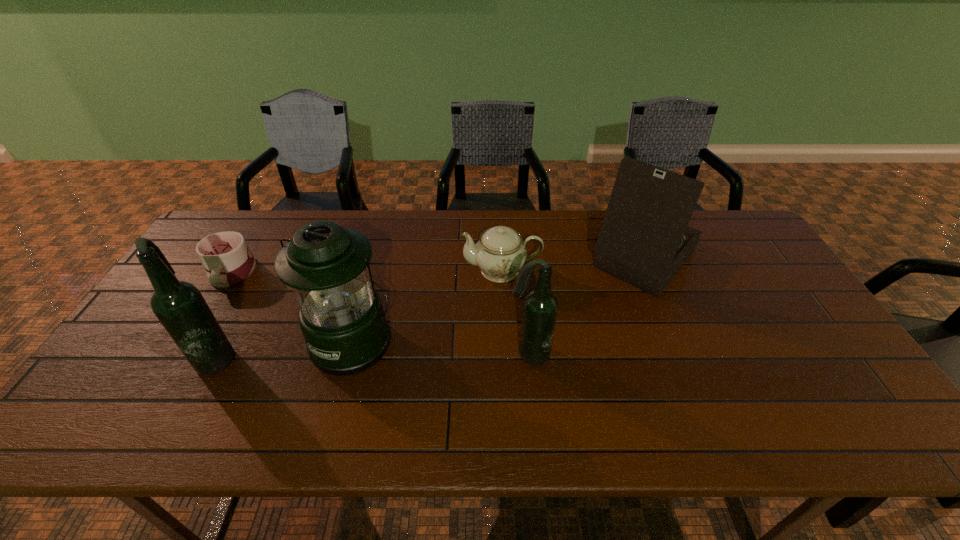
Locate an element on the screen. Image resolution: width=960 pixels, height=540 pixels. the left beer bottle is located at coordinates (180, 307).

This screenshot has height=540, width=960. Identify the location of the shorter beer bottle. (540, 308).

What are the coordinates of `the third shortest object` in the screenshot? It's located at (540, 308).

This screenshot has width=960, height=540. I want to click on the rightmost object, so click(x=644, y=240).

The height and width of the screenshot is (540, 960). What are the coordinates of `the fifth tallest object` in the screenshot? It's located at (500, 253).

Locate an element on the screen. The width and height of the screenshot is (960, 540). lantern is located at coordinates (341, 316).

You are a GUI agent. You are given a task and a screenshot of the screen. Output one action in this format:
    pyautogui.click(x=<x>, y=<y>)
    Task: Click on the shortest object
    The height and width of the screenshot is (540, 960).
    Given the screenshot: What is the action you would take?
    pyautogui.click(x=227, y=260)

The image size is (960, 540). I want to click on vacant space positioned 0.160m on the right of the left beer bottle, so click(x=300, y=356).

Locate an element on the screen. This screenshot has height=540, width=960. free location located 0.230m on the left of the fourth tallest object is located at coordinates (418, 354).

This screenshot has width=960, height=540. Find the location of `free space located 0.050m on the right of the phonograph record`. free space located 0.050m on the right of the phonograph record is located at coordinates (716, 258).